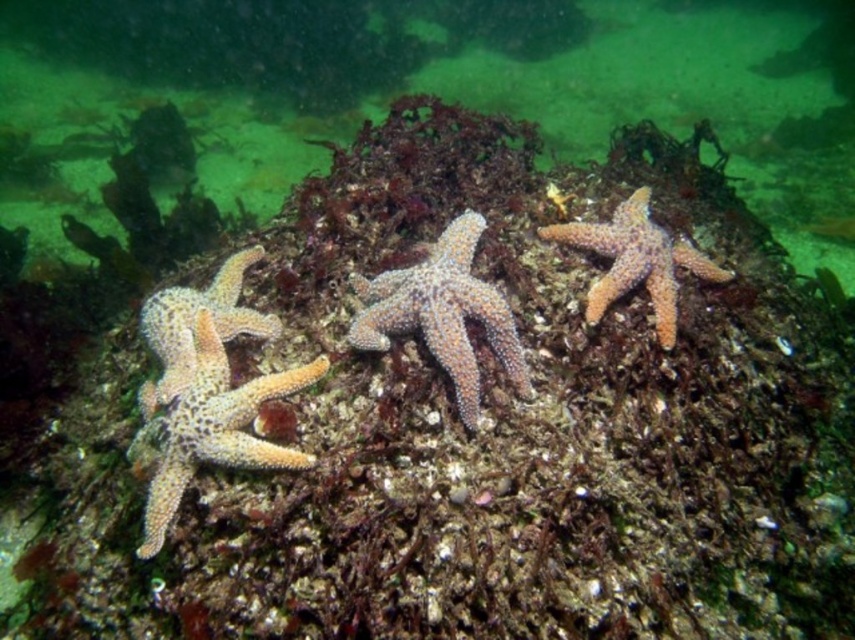
You are a marine biologist studying starfish in the underwater scene. You notice two orange spiny starfish. Which one is positioned higher in the image, the orange spiny starfish at center or the orange spiny starfish at left?

The orange spiny starfish at center is positioned higher than the orange spiny starfish at left in the image.

You are a marine biologist studying starfish species in this underwater scene. You notice two starfish labeled as orange rough starfish at left and orange spiny starfish at left. Based on their positions, which one is located to the right of the other?

The orange rough starfish at left is positioned to the right of the orange spiny starfish at left.

You are a marine biologist studying underwater life. You observe an orange spiny starfish at center in the image. Based on its coordinates at point 0.489, 0.518, can you determine its position relative to the center of the image?

The orange spiny starfish at center is located exactly at the center of the image since its coordinates are approximately [441,312], which is very close to the midpoint.